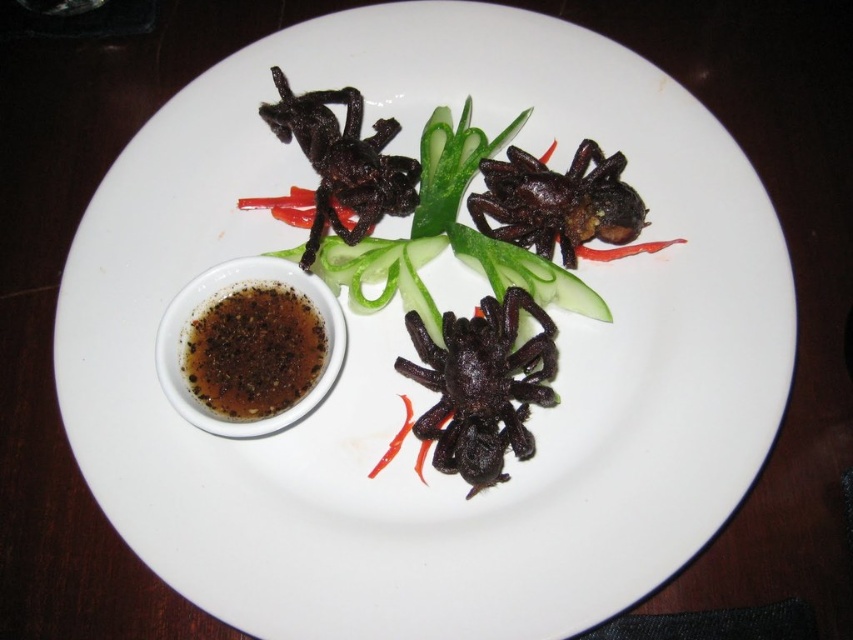
Question: Can you confirm if black matte spider at center is bigger than shiny black spider at upper center?

Choices:
 (A) yes
 (B) no

Answer: (A)

Question: Which of the following is the farthest from the observer?

Choices:
 (A) (309, 364)
 (B) (492, 218)
 (C) (372, 225)
 (D) (526, 360)

Answer: (B)

Question: Can you confirm if black matte spider at center is positioned below brown glossy sauce at lower left?

Choices:
 (A) no
 (B) yes

Answer: (B)

Question: Among these objects, which one is farthest from the camera?

Choices:
 (A) shiny black spider at upper center
 (B) brown glossy sauce at lower left
 (C) black matte spider at upper left
 (D) black crispy spider at center

Answer: (A)

Question: Which of the following is the farthest from the observer?

Choices:
 (A) (462, 369)
 (B) (602, 321)
 (C) (529, 198)
 (D) (373, 195)

Answer: (D)

Question: Does black crispy spider at center come in front of shiny black spider at upper center?

Choices:
 (A) no
 (B) yes

Answer: (B)